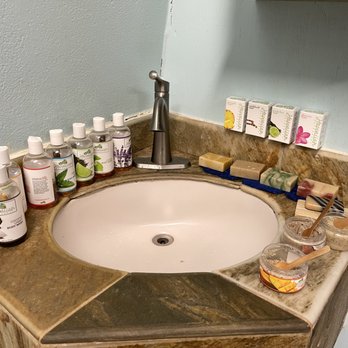
You are a GUI agent. You are given a task and a screenshot of the screen. Output one action in this format:
    pyautogui.click(x=<x>, y=<y>)
    Task: Click on the hand soap
    Image resolution: width=348 pixels, height=348 pixels.
    Given the screenshot: What is the action you would take?
    [x=12, y=216], [x=38, y=191], [x=61, y=180], [x=88, y=164], [x=99, y=160], [x=119, y=153], [x=21, y=187]